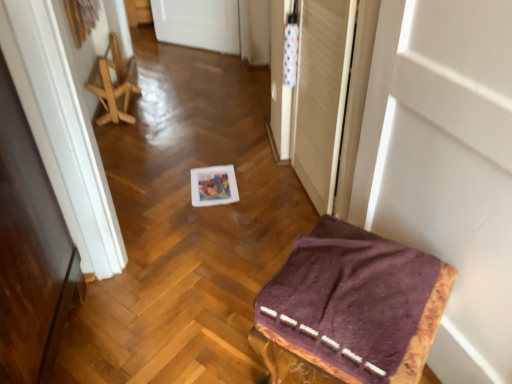
What is the approximate width of white matte door at upper right?

white matte door at upper right is 14.74 centimeters in width.

In order to face wooden folding chair at left, placed as the 1th furniture when sorted from left to right, should I rotate leftwards or rightwards?

To face it directly, rotate left by 18.298 degrees.

Locate an element on the screen. The width and height of the screenshot is (512, 384). purple fabric-covered stool at lower right, which appears as the 1th furniture when ordered from the bottom is located at coordinates (350, 309).

What do you see at coordinates (321, 95) in the screenshot? I see `transparent plastic screen door at upper right` at bounding box center [321, 95].

In order to click on white matte door at upper right in this screenshot , I will do `click(447, 166)`.

Considering the relative sizes of purple fabric-covered stool at lower right, acting as the 2th furniture starting from the back, and wooden folding chair at left, marked as the 2th furniture in a right-to-left arrangement, in the image provided, is purple fabric-covered stool at lower right, acting as the 2th furniture starting from the back, shorter than wooden folding chair at left, marked as the 2th furniture in a right-to-left arrangement,?

In fact, purple fabric-covered stool at lower right, acting as the 2th furniture starting from the back, may be taller than wooden folding chair at left, marked as the 2th furniture in a right-to-left arrangement.

Does purple fabric-covered stool at lower right, which appears as the 1th furniture when ordered from the bottom, contain wooden folding chair at left, acting as the second furniture starting from the front?

No, purple fabric-covered stool at lower right, which appears as the 1th furniture when ordered from the bottom, does not contain wooden folding chair at left, acting as the second furniture starting from the front.

Is the surface of purple fabric-covered stool at lower right, arranged as the first furniture when viewed from the right, in direct contact with wooden folding chair at left, placed as the 1th furniture when sorted from left to right?

No, purple fabric-covered stool at lower right, arranged as the first furniture when viewed from the right, is not making contact with wooden folding chair at left, placed as the 1th furniture when sorted from left to right.

From the image's perspective, between wooden folding chair at left, marked as the 2th furniture in a right-to-left arrangement, and white matte door at upper right, which one is located above?

wooden folding chair at left, marked as the 2th furniture in a right-to-left arrangement.

Is wooden folding chair at left, which is the first furniture from back to front, in front of or behind white matte door at upper right in the image?

In the image, wooden folding chair at left, which is the first furniture from back to front, appears behind white matte door at upper right.

Is wooden folding chair at left, acting as the second furniture starting from the front, facing towards white matte door at upper right?

No, wooden folding chair at left, acting as the second furniture starting from the front, is not facing towards white matte door at upper right.

Does wooden folding chair at left, placed as the 1th furniture when sorted from left to right, have a smaller size compared to white matte door at upper right?

Correct, wooden folding chair at left, placed as the 1th furniture when sorted from left to right, occupies less space than white matte door at upper right.

From the image's perspective, is purple fabric-covered stool at lower right, the first furniture positioned from the front, beneath white matte door at upper right?

Correct, purple fabric-covered stool at lower right, the first furniture positioned from the front, appears lower than white matte door at upper right in the image.

Locate an element on the screen. Image resolution: width=512 pixels, height=384 pixels. door above the purple fabric-covered stool at lower right, which appears as the 1th furniture when ordered from the bottom (from a real-world perspective) is located at coordinates (447, 166).

Could you tell me if purple fabric-covered stool at lower right, acting as the 2th furniture starting from the back, is turned towards white matte door at upper right?

No.

Is purple fabric-covered stool at lower right, acting as the 2th furniture starting from the back, positioned beyond the bounds of white matte door at upper right?

Yes, purple fabric-covered stool at lower right, acting as the 2th furniture starting from the back, is not within white matte door at upper right.

Which point is more forward, (322, 188) or (117, 45)?

The point (322, 188) is in front.

Who is bigger, transparent plastic screen door at upper right or wooden folding chair at left, marked as the 2th furniture in a right-to-left arrangement?

wooden folding chair at left, marked as the 2th furniture in a right-to-left arrangement, is bigger.

Is transparent plastic screen door at upper right beside wooden folding chair at left, placed as the 1th furniture when sorted from left to right?

transparent plastic screen door at upper right and wooden folding chair at left, placed as the 1th furniture when sorted from left to right, are clearly separated.

Considering the positions of objects purple fabric-covered stool at lower right, which appears as the 1th furniture when ordered from the bottom, and transparent plastic screen door at upper right in the image provided, who is more to the right, purple fabric-covered stool at lower right, which appears as the 1th furniture when ordered from the bottom, or transparent plastic screen door at upper right?

From the viewer's perspective, purple fabric-covered stool at lower right, which appears as the 1th furniture when ordered from the bottom, appears more on the right side.

From a real-world perspective, between purple fabric-covered stool at lower right, acting as the 2th furniture starting from the left, and transparent plastic screen door at upper right, who is vertically higher?

From a 3D spatial view, transparent plastic screen door at upper right is above.

Can you confirm if purple fabric-covered stool at lower right, acting as the 2th furniture starting from the left, is taller than transparent plastic screen door at upper right?

In fact, purple fabric-covered stool at lower right, acting as the 2th furniture starting from the left, may be shorter than transparent plastic screen door at upper right.

Would you consider purple fabric-covered stool at lower right, arranged as the first furniture when viewed from the right, to be distant from transparent plastic screen door at upper right?

No, purple fabric-covered stool at lower right, arranged as the first furniture when viewed from the right, is not far away from transparent plastic screen door at upper right.

Consider the image. Considering the sizes of objects transparent plastic screen door at upper right and purple fabric-covered stool at lower right, acting as the 2th furniture starting from the left, in the image provided, who is shorter, transparent plastic screen door at upper right or purple fabric-covered stool at lower right, acting as the 2th furniture starting from the left,?

Standing shorter between the two is purple fabric-covered stool at lower right, acting as the 2th furniture starting from the left.

Can you see transparent plastic screen door at upper right touching purple fabric-covered stool at lower right, arranged as the first furniture when viewed from the right?

No, transparent plastic screen door at upper right is not next to purple fabric-covered stool at lower right, arranged as the first furniture when viewed from the right.

I want to click on screen door above the purple fabric-covered stool at lower right, arranged as the first furniture when viewed from the right (from the image's perspective), so click(x=321, y=95).

Is transparent plastic screen door at upper right not inside purple fabric-covered stool at lower right, which appears as the 1th furniture when ordered from the bottom?

transparent plastic screen door at upper right lies outside purple fabric-covered stool at lower right, which appears as the 1th furniture when ordered from the bottom,'s area.

From a real-world perspective, is wooden folding chair at left, which is the first furniture from back to front, positioned under purple fabric-covered stool at lower right, acting as the 2th furniture starting from the left, based on gravity?

Yes, from a real-world perspective, wooden folding chair at left, which is the first furniture from back to front, is under purple fabric-covered stool at lower right, acting as the 2th furniture starting from the left.

Looking at this image, is wooden folding chair at left, which is the first furniture from back to front, bigger than purple fabric-covered stool at lower right, which appears as the 1th furniture when ordered from the bottom?

Actually, wooden folding chair at left, which is the first furniture from back to front, might be smaller than purple fabric-covered stool at lower right, which appears as the 1th furniture when ordered from the bottom.

In the image, is wooden folding chair at left, which is the first furniture from back to front, positioned in front of or behind purple fabric-covered stool at lower right, the first furniture positioned from the front?

Visually, wooden folding chair at left, which is the first furniture from back to front, is located behind purple fabric-covered stool at lower right, the first furniture positioned from the front.

Is wooden folding chair at left, placed as the 1th furniture when sorted from left to right, to the right of purple fabric-covered stool at lower right, which appears as the 1th furniture when ordered from the bottom, from the viewer's perspective?

No.

You are a GUI agent. You are given a task and a screenshot of the screen. Output one action in this format:
    pyautogui.click(x=<x>, y=<y>)
    Task: Click on the furniture located in front of the wooden folding chair at left, which ranks as the second furniture in bottom-to-top order
    
    Given the screenshot: What is the action you would take?
    pyautogui.click(x=350, y=309)

In the image, there is a wooden folding chair at left, acting as the second furniture starting from the front. Find the location of `door below it (from the image's perspective)`. door below it (from the image's perspective) is located at coordinates 447,166.

Looking at the image, which one is located further to purple fabric-covered stool at lower right, placed as the second furniture when sorted from top to bottom, white matte door at upper right or wooden folding chair at left, which is the first furniture from back to front?

wooden folding chair at left, which is the first furniture from back to front, is further to purple fabric-covered stool at lower right, placed as the second furniture when sorted from top to bottom.

Which object lies further to the anchor point transparent plastic screen door at upper right, wooden folding chair at left, which is the first furniture from back to front, or white matte door at upper right?

wooden folding chair at left, which is the first furniture from back to front, is positioned further to the anchor transparent plastic screen door at upper right.

When comparing their distances from transparent plastic screen door at upper right, does purple fabric-covered stool at lower right, the first furniture positioned from the front, or white matte door at upper right seem further?

purple fabric-covered stool at lower right, the first furniture positioned from the front, is further to transparent plastic screen door at upper right.

From the image, which object appears to be nearer to white matte door at upper right, purple fabric-covered stool at lower right, the first furniture positioned from the front, or transparent plastic screen door at upper right?

purple fabric-covered stool at lower right, the first furniture positioned from the front, is closer to white matte door at upper right.

Based on their spatial positions, is transparent plastic screen door at upper right or wooden folding chair at left, the first furniture in the top-to-bottom sequence, closer to white matte door at upper right?

Based on the image, transparent plastic screen door at upper right appears to be nearer to white matte door at upper right.

When comparing their distances from purple fabric-covered stool at lower right, arranged as the first furniture when viewed from the right, does white matte door at upper right or transparent plastic screen door at upper right seem further?

transparent plastic screen door at upper right lies further to purple fabric-covered stool at lower right, arranged as the first furniture when viewed from the right, than the other object.

Based on their spatial positions, is wooden folding chair at left, the first furniture in the top-to-bottom sequence, or purple fabric-covered stool at lower right, placed as the second furniture when sorted from top to bottom, closer to white matte door at upper right?

Among the two, purple fabric-covered stool at lower right, placed as the second furniture when sorted from top to bottom, is located nearer to white matte door at upper right.

When comparing their distances from purple fabric-covered stool at lower right, acting as the 2th furniture starting from the left, does wooden folding chair at left, the first furniture in the top-to-bottom sequence, or transparent plastic screen door at upper right seem further?

wooden folding chair at left, the first furniture in the top-to-bottom sequence, is further to purple fabric-covered stool at lower right, acting as the 2th furniture starting from the left.

Find the location of a particular element. The height and width of the screenshot is (384, 512). screen door located between white matte door at upper right and wooden folding chair at left, marked as the 2th furniture in a right-to-left arrangement, in the depth direction is located at coordinates (321, 95).

The height and width of the screenshot is (384, 512). I want to click on furniture between white matte door at upper right and transparent plastic screen door at upper right in the front-back direction, so click(350, 309).

Identify the location of furniture between white matte door at upper right and wooden folding chair at left, the first furniture in the top-to-bottom sequence, in the front-back direction. (350, 309).

The image size is (512, 384). I want to click on screen door positioned between purple fabric-covered stool at lower right, which appears as the 1th furniture when ordered from the bottom, and wooden folding chair at left, placed as the 1th furniture when sorted from left to right, from near to far, so click(x=321, y=95).